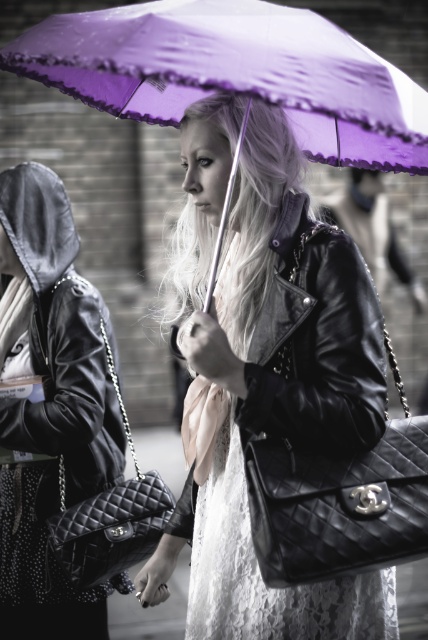
You are a photographer trying to capture both the black quilted leather handbag at center and the purple satin umbrella at center in a single shot. Which object should you adjust your camera focus on first to ensure both are in focus?

The black quilted leather handbag at center is closer to the viewer than the purple satin umbrella at center. To ensure both are in focus, adjust the camera focus on the black quilted leather handbag at center first, as it is nearer and setting focus on it will help capture the umbrella in the background more effectively.

You are a delivery robot with a width of 1.5 meters. You need to navigate through the street scene depicted in the image. Can you pass between the purple satin umbrella at center and the black quilted leather handbag at left without touching either?

The distance between the purple satin umbrella at center and the black quilted leather handbag at left is 2.25 meters. Since the robot is 1.5 meters wide, there is sufficient space to pass between them without touching either object.

You are a fashion designer observing the street scene. You notice the black quilted leather handbag at center and the purple satin umbrella at center. Which item would require more fabric to create, based on their sizes?

The black quilted leather handbag at center is larger in size than the purple satin umbrella at center, so it would require more fabric to create.